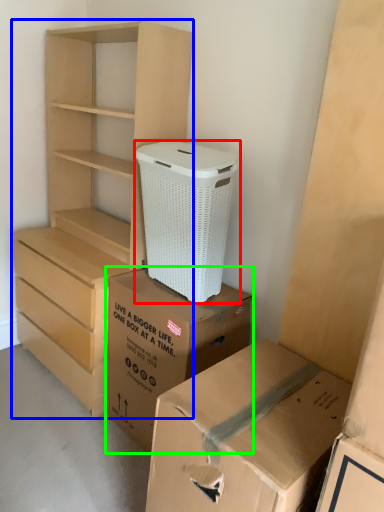
Question: Which object is the farthest from shoe box (highlighted by a red box)? Choose among these: chest of drawers (highlighted by a blue box) or box (highlighted by a green box).

Choices:
 (A) chest of drawers
 (B) box

Answer: (A)